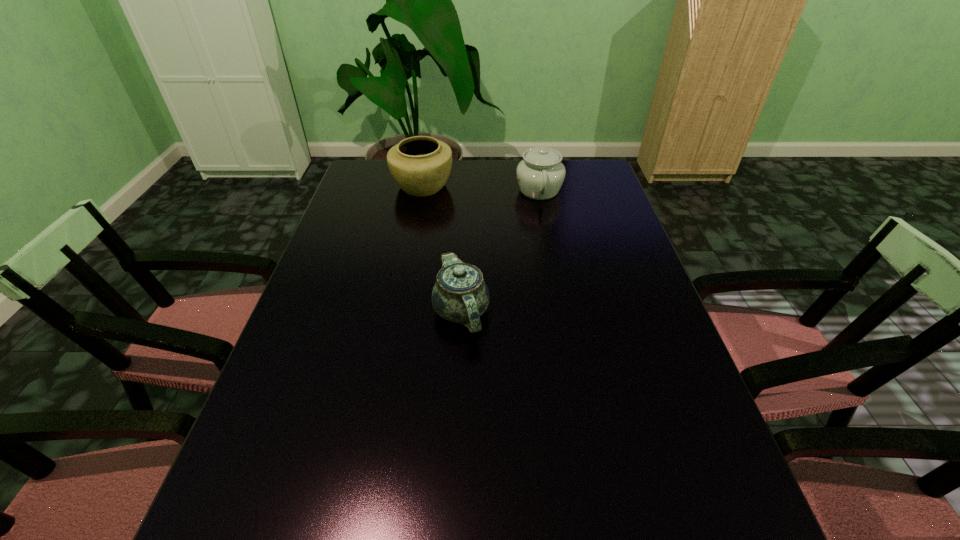
Find the location of a particular element. The height and width of the screenshot is (540, 960). free space between the pottery and the nearest object is located at coordinates (x=442, y=249).

The image size is (960, 540). What are the coordinates of `vacant area that lies between the pottery and the rightmost object` in the screenshot? It's located at (481, 188).

This screenshot has width=960, height=540. I want to click on free point between the farther chinaware and the pottery, so click(481, 188).

Find the location of a particular element. This screenshot has height=540, width=960. free space between the pottery and the rightmost object is located at coordinates tap(481, 188).

The height and width of the screenshot is (540, 960). I want to click on free space between the pottery and the nearer chinaware, so click(442, 249).

Where is `free spot between the right chinaware and the left chinaware`? Image resolution: width=960 pixels, height=540 pixels. free spot between the right chinaware and the left chinaware is located at coordinates (500, 251).

Image resolution: width=960 pixels, height=540 pixels. Identify the location of free space between the left chinaware and the pottery. (442, 249).

I want to click on free space that is in between the pottery and the nearer chinaware, so click(x=442, y=249).

Find the location of a particular element. Image resolution: width=960 pixels, height=540 pixels. free point between the rightmost object and the pottery is located at coordinates (481, 188).

Find the location of a particular element. Image resolution: width=960 pixels, height=540 pixels. object that stands as the closest to the rightmost object is located at coordinates (420, 165).